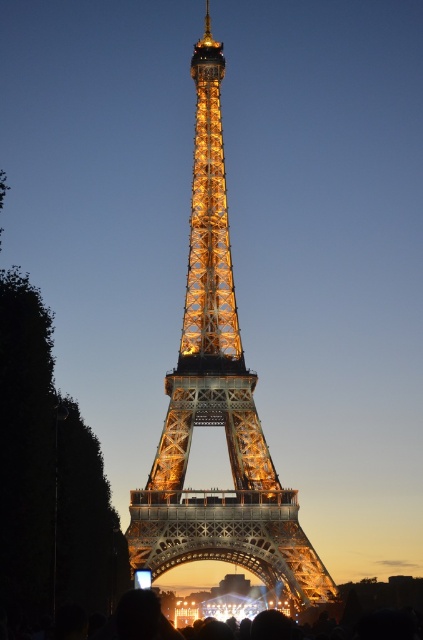
Question: Is illuminated steel eiffel tower at center thinner than black matte crowd at lower center?

Choices:
 (A) no
 (B) yes

Answer: (B)

Question: Among these points, which one is farthest from the camera?

Choices:
 (A) (153, 509)
 (B) (164, 596)

Answer: (B)

Question: Among these points, which one is farthest from the camera?

Choices:
 (A) (231, 308)
 (B) (382, 586)

Answer: (B)

Question: Does illuminated steel eiffel tower at center have a larger size compared to black matte crowd at lower center?

Choices:
 (A) yes
 (B) no

Answer: (A)

Question: Can you confirm if illuminated steel eiffel tower at center is positioned to the left of black matte crowd at lower center?

Choices:
 (A) yes
 (B) no

Answer: (A)